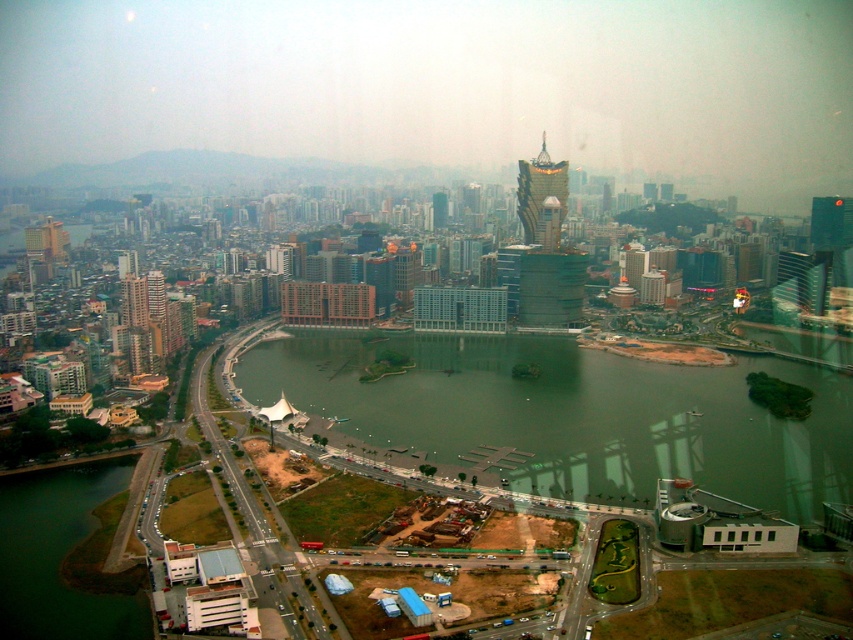
Question: Which point is closer to the camera?

Choices:
 (A) pos(521,195)
 (B) pos(517,196)
 (C) pos(25,580)
 (D) pos(326,401)

Answer: (C)

Question: Among these objects, which one is nearest to the camera?

Choices:
 (A) green grassy embankment at lower left
 (B) gold reflective tower at center
 (C) green water at center

Answer: (A)

Question: Where is green water at center located in relation to gold metallic tower at center in the image?

Choices:
 (A) left
 (B) right

Answer: (A)

Question: Among these objects, which one is farthest from the camera?

Choices:
 (A) gold metallic tower at center
 (B) gold reflective tower at center
 (C) green grassy embankment at lower left

Answer: (B)

Question: Can you confirm if green grassy embankment at lower left is thinner than gold reflective tower at center?

Choices:
 (A) no
 (B) yes

Answer: (A)

Question: In this image, where is green grassy embankment at lower left located relative to gold reflective tower at center?

Choices:
 (A) left
 (B) right

Answer: (A)